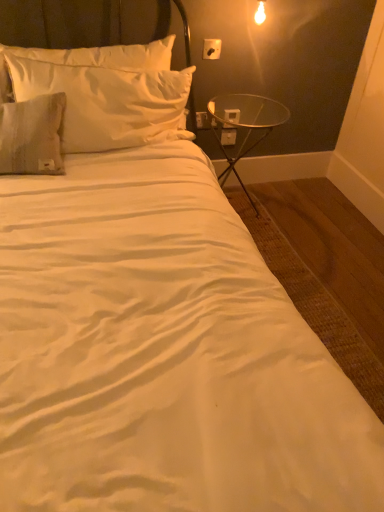
Question: From a real-world perspective, is transparent glass table at right below white plastic electric outlet at upper right, the second electric outlet from the back?

Choices:
 (A) yes
 (B) no

Answer: (A)

Question: Is transparent glass table at right further to camera compared to white plastic electric outlet at upper right, the second electric outlet in the bottom-to-top sequence?

Choices:
 (A) yes
 (B) no

Answer: (B)

Question: Could you tell me if transparent glass table at right is turned towards white plastic electric outlet at upper right, the second electric outlet from the back?

Choices:
 (A) no
 (B) yes

Answer: (A)

Question: From the image's perspective, is transparent glass table at right over white plastic electric outlet at upper right, which is the second electric outlet from front to back?

Choices:
 (A) yes
 (B) no

Answer: (B)

Question: Is transparent glass table at right taller than white plastic electric outlet at upper right, the second electric outlet in the bottom-to-top sequence?

Choices:
 (A) no
 (B) yes

Answer: (B)

Question: From the image's perspective, relative to satin white pillow at upper left, is white plastic electric outlet at upper right, arranged as the third electric outlet when viewed from the top, above or below?

Choices:
 (A) above
 (B) below

Answer: (B)

Question: Does point (236, 132) appear closer or farther from the camera than point (66, 75)?

Choices:
 (A) closer
 (B) farther

Answer: (B)

Question: Visually, is white plastic electric outlet at upper right, the 3th electric outlet positioned from the front, positioned to the left or to the right of satin white pillow at upper left?

Choices:
 (A) right
 (B) left

Answer: (A)

Question: From a real-world perspective, is white plastic electric outlet at upper right, arranged as the 1th electric outlet when viewed from the back, physically located above or below satin white pillow at upper left?

Choices:
 (A) above
 (B) below

Answer: (B)

Question: Considering the relative positions of transparent glass table at right and white plastic electric outlet at upper right, the 3th electric outlet positioned from the front, in the image provided, is transparent glass table at right to the left or to the right of white plastic electric outlet at upper right, the 3th electric outlet positioned from the front,?

Choices:
 (A) left
 (B) right

Answer: (B)

Question: From their relative heights in the image, would you say transparent glass table at right is taller or shorter than white plastic electric outlet at upper right, arranged as the third electric outlet when viewed from the top?

Choices:
 (A) tall
 (B) short

Answer: (A)

Question: Based on their sizes in the image, would you say transparent glass table at right is bigger or smaller than white plastic electric outlet at upper right, the 3th electric outlet positioned from the front?

Choices:
 (A) small
 (B) big

Answer: (B)

Question: From the image's perspective, is transparent glass table at right positioned above or below white plastic electric outlet at upper right, the 3th electric outlet positioned from the front?

Choices:
 (A) below
 (B) above

Answer: (A)

Question: Is white plastic electric outlet at upper right, which is the second electric outlet from front to back, wider or thinner than satin white pillow at upper left?

Choices:
 (A) wide
 (B) thin

Answer: (B)

Question: From a real-world perspective, relative to satin white pillow at upper left, is white plastic electric outlet at upper right, which is the second electric outlet from front to back, vertically above or below?

Choices:
 (A) below
 (B) above

Answer: (A)